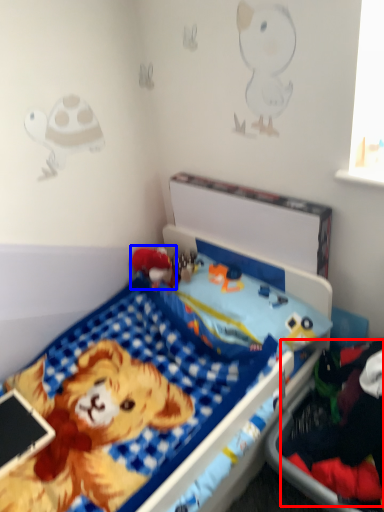
Question: Which object appears closest to the camera in this image, clothing (highlighted by a red box) or toy (highlighted by a blue box)?

Choices:
 (A) clothing
 (B) toy

Answer: (A)